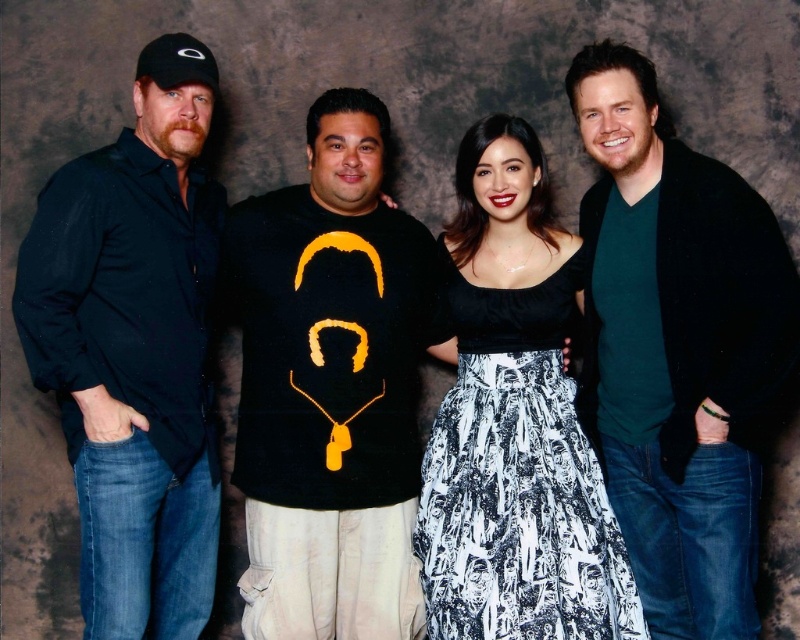
You are a photographer who wants to adjust the lighting to highlight the green matte shirt at center and the black satin dress at center. Which object should you focus the light on first if you want to ensure both are equally illuminated, considering their current positions?

The green matte shirt at center is positioned on the right side of black satin dress at center. To equally illuminate both, focus the light on the black satin dress at center first since it is closer to the left and might need more light to balance with the right side.

Looking at this image, you are standing in front of a group photo and want to touch the black satin dress at center without touching the black matte shirt at left. Is this possible?

The black matte shirt at left is closer to you than the black satin dress at center. Since the black matte shirt at left is in front, you cannot reach the black satin dress at center without touching the black matte shirt at left.